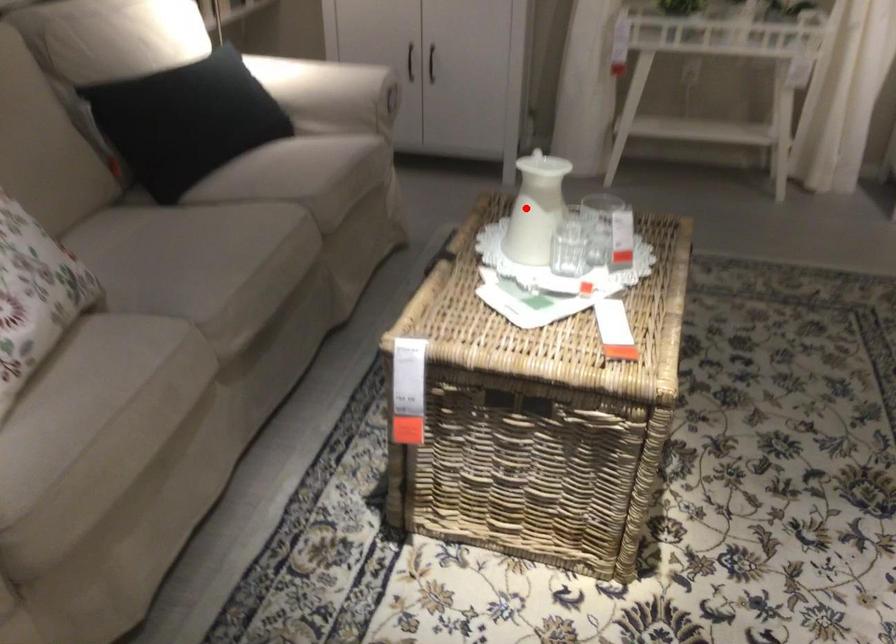
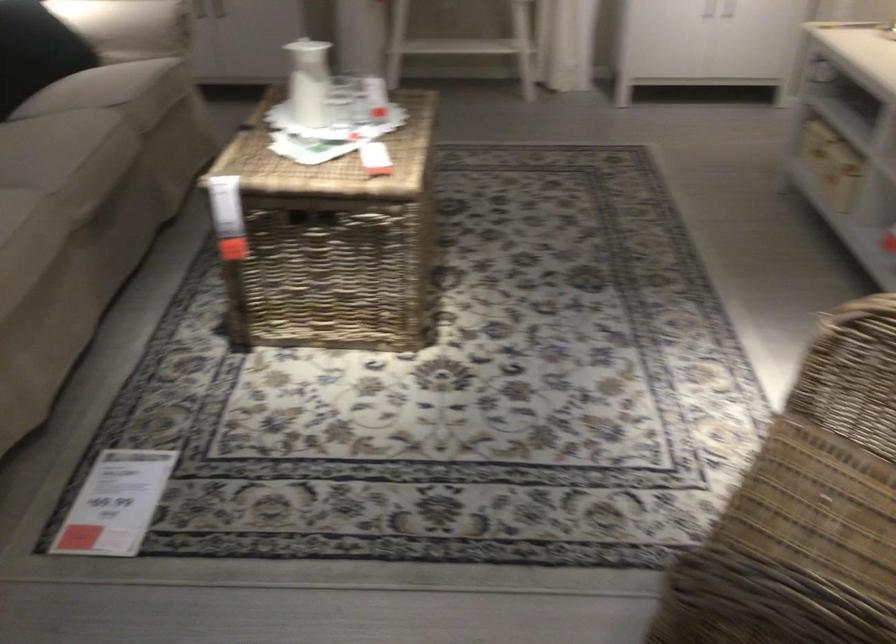
Question: I am providing you with two images of the same scene from different viewpoints. In image1, a red point is highlighted. Considering the same 3D point in image2, which of the following is correct?

Choices:
 (A) It is closer
 (B) It is farther

Answer: (B)